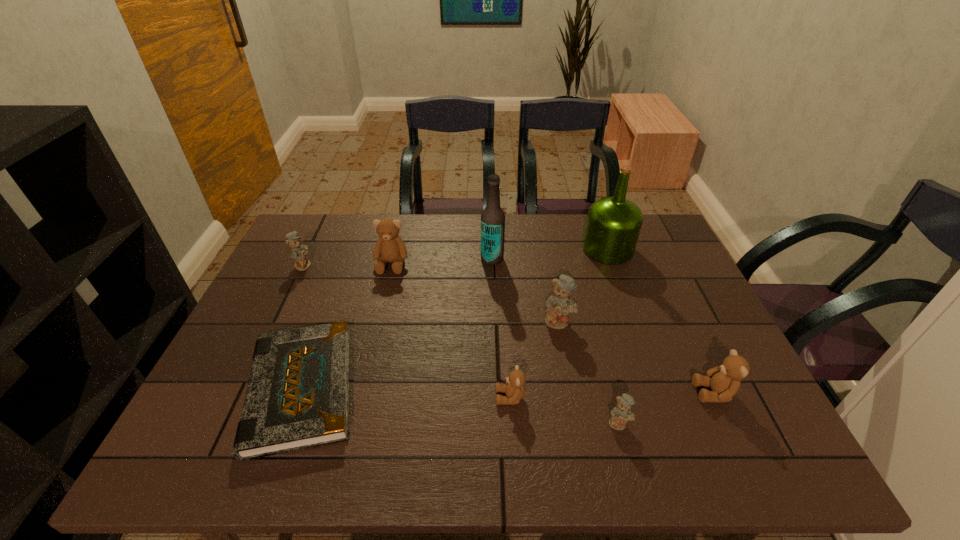
Locate an element on the screen. This screenshot has height=540, width=960. teddy bear that is the fifth nearest to the leftmost teddy bear is located at coordinates (724, 380).

Locate an element on the screen. This screenshot has height=540, width=960. blue teddy bear that can be found as the second closest to the fifth teddy bear from left to right is located at coordinates (298, 252).

Find the location of `blue teddy bear that is the closest to the fourth teddy bear from left to right`. blue teddy bear that is the closest to the fourth teddy bear from left to right is located at coordinates (621, 414).

Choose which brown teddy bear is the second nearest neighbor to the farthest brown teddy bear. Please provide its 2D coordinates. Your answer should be formatted as a tuple, i.e. [(x, y)], where the tuple contains the x and y coordinates of a point satisfying the conditions above.

[(724, 380)]

Select which brown teddy bear appears as the second closest to the farthest brown teddy bear. Please provide its 2D coordinates. Your answer should be formatted as a tuple, i.e. [(x, y)], where the tuple contains the x and y coordinates of a point satisfying the conditions above.

[(724, 380)]

Locate an element on the screen. free space in the image that satisfies the following two spatial constraints: 1. on the front-facing side of the notebook; 2. on the right side of the farthest blue teddy bear is located at coordinates (245, 389).